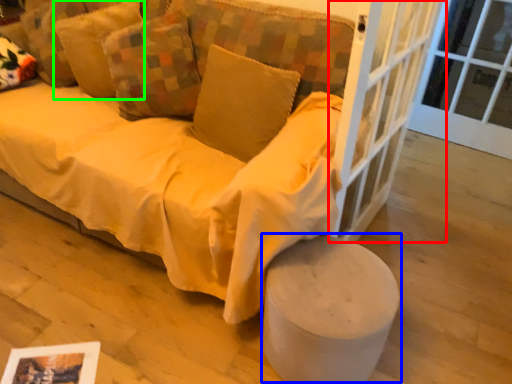
Question: Considering the real-world distances, which object is closest to screen door (highlighted by a red box)? stool (highlighted by a blue box) or pillow (highlighted by a green box).

Choices:
 (A) stool
 (B) pillow

Answer: (A)